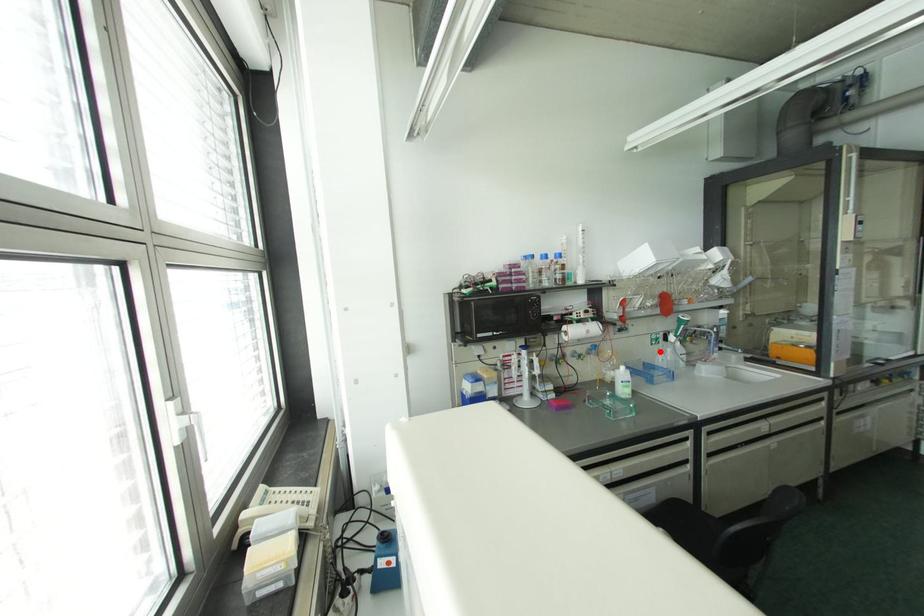
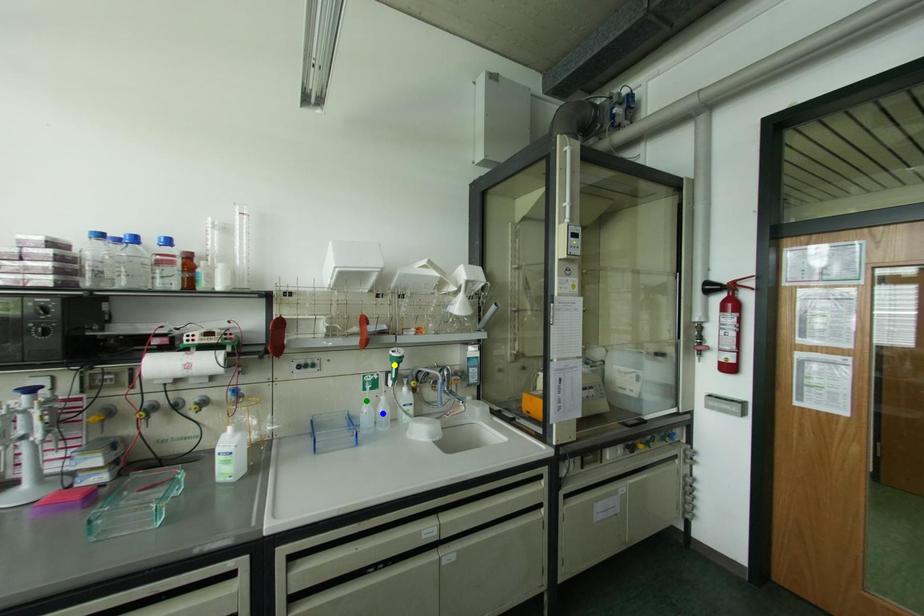
Question: I am providing you with two images of the same scene from different viewpoints. A red point is marked on the first image. You are given multiple points on the second image. Which mark in image 2 goes with the point in image 1?

Choices:
 (A) yellow point
 (B) green point
 (C) blue point

Answer: (B)